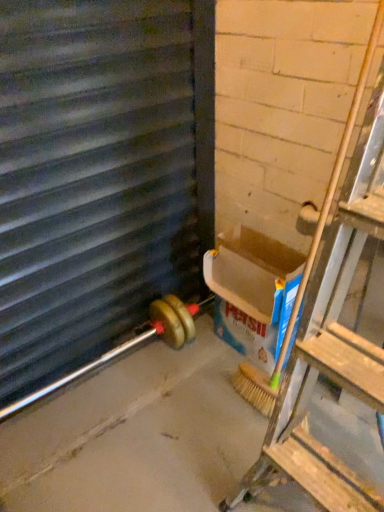
Question: Do you think metallic gray window frame at left is within blue cardboard box at right, or outside of it?

Choices:
 (A) outside
 (B) inside

Answer: (A)

Question: Considering the positions of metallic gray window frame at left and blue cardboard box at right in the image, is metallic gray window frame at left taller or shorter than blue cardboard box at right?

Choices:
 (A) tall
 (B) short

Answer: (A)

Question: Is metallic gray window frame at left wider or thinner than blue cardboard box at right?

Choices:
 (A) thin
 (B) wide

Answer: (A)

Question: Choose the correct answer: Is blue cardboard box at right inside metallic gray window frame at left or outside it?

Choices:
 (A) inside
 (B) outside

Answer: (B)

Question: Does point (256, 246) appear closer or farther from the camera than point (59, 82)?

Choices:
 (A) closer
 (B) farther

Answer: (B)

Question: In the image, is blue cardboard box at right positioned in front of or behind metallic gray window frame at left?

Choices:
 (A) behind
 (B) front

Answer: (A)

Question: Is blue cardboard box at right bigger or smaller than metallic gray window frame at left?

Choices:
 (A) big
 (B) small

Answer: (B)